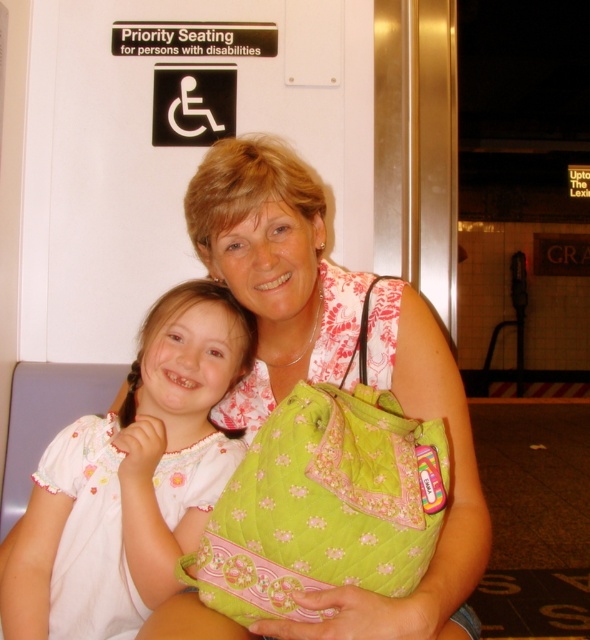
You are a photographer taking a picture of the white embroidered dress at center and the green quilted shoulder bag at center. Which object is positioned lower in the image?

The white embroidered dress at center is positioned below the green quilted shoulder bag at center, so it is lower in the image.

You are a photographer trying to capture a candid shot of the white embroidered dress at center and the green quilted shoulder bag at center. Which object is closer to the camera?

The white embroidered dress at center is closer to the camera than the green quilted shoulder bag at center because it is further to the viewer.